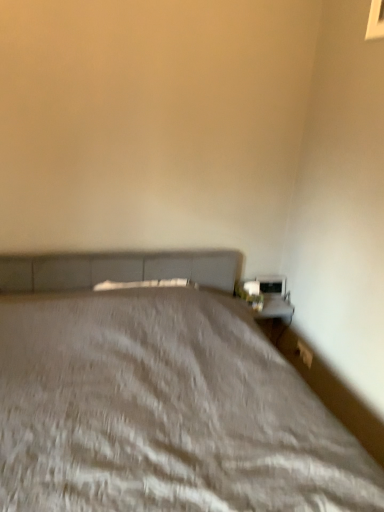
What do you see at coordinates (304, 353) in the screenshot? Image resolution: width=384 pixels, height=512 pixels. I see `white plastic electric outlet at lower right` at bounding box center [304, 353].

What is the approximate width of white plastic electric outlet at lower right?

white plastic electric outlet at lower right is 1.69 centimeters in width.

In order to click on white plastic electric outlet at lower right in this screenshot , I will do `click(304, 353)`.

Locate an element on the screen. This screenshot has height=512, width=384. white plastic electric outlet at lower right is located at coordinates (304, 353).